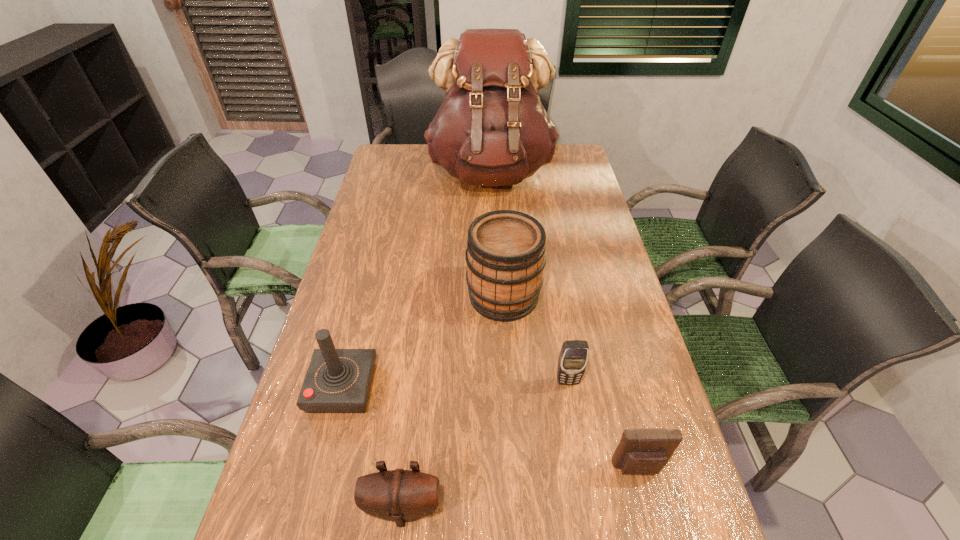
Identify the location of free spot at the left edge of the desktop. (379, 325).

Locate an element on the screen. The width and height of the screenshot is (960, 540). vacant region at the right edge of the desktop is located at coordinates (632, 325).

In the image, there is a desktop. Identify the location of free space at the far left corner. Image resolution: width=960 pixels, height=540 pixels. (399, 160).

In the image, there is a desktop. In order to click on vacant region at the far right corner in this screenshot , I will do `click(565, 163)`.

This screenshot has width=960, height=540. What are the coordinates of `vacant space in between the nearer pouch and the joystick` in the screenshot? It's located at (372, 448).

Where is `vacant space in between the nearer pouch and the fourth shortest object`? The width and height of the screenshot is (960, 540). vacant space in between the nearer pouch and the fourth shortest object is located at coordinates (372, 448).

You are a GUI agent. You are given a task and a screenshot of the screen. Output one action in this format:
    pyautogui.click(x=<x>, y=<y>)
    Task: Click on the vacant area that lies between the cellular telephone and the nearest object
    The width and height of the screenshot is (960, 540).
    Given the screenshot: What is the action you would take?
    tap(486, 444)

In order to click on free area in between the right pouch and the cellular telephone in this screenshot , I will do `click(603, 425)`.

What are the coordinates of `unoccupied position between the second farthest object and the cellular telephone` in the screenshot? It's located at (536, 339).

Where is `object that is the fifth closest one to the joystick`? The width and height of the screenshot is (960, 540). object that is the fifth closest one to the joystick is located at coordinates (491, 129).